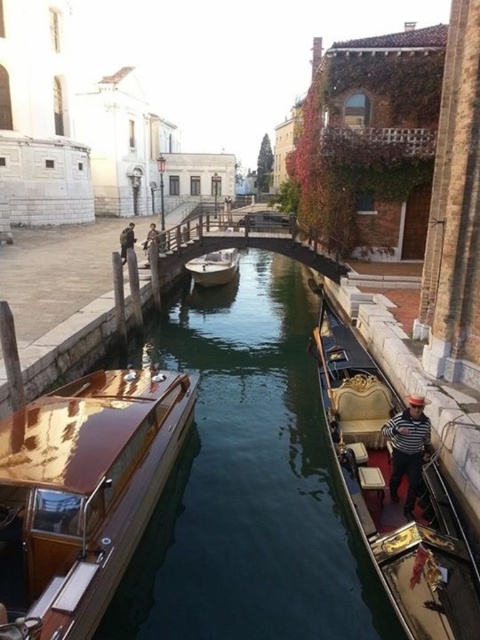
Question: Based on their relative distances, which object is nearer to the glossy wood boat at center?

Choices:
 (A) wooden polished boat at center
 (B) gold polished wood gondola at center

Answer: (B)

Question: Which point appears closest to the camera in this image?

Choices:
 (A) (214, 269)
 (B) (405, 576)

Answer: (B)

Question: Is gold polished wood gondola at center positioned before wooden polished boat at center?

Choices:
 (A) yes
 (B) no

Answer: (A)

Question: Which point is closer to the camera taking this photo?

Choices:
 (A) (70, 570)
 (B) (429, 483)

Answer: (A)

Question: Is glossy wood boat at center to the left of wooden polished boat at center from the viewer's perspective?

Choices:
 (A) no
 (B) yes

Answer: (B)

Question: Is glossy wood boat at center further to camera compared to gold polished wood gondola at center?

Choices:
 (A) yes
 (B) no

Answer: (B)